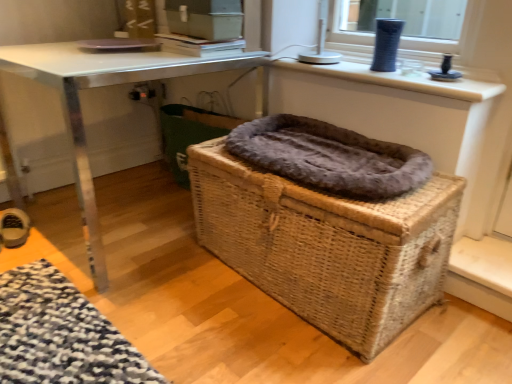
Where is `vacant region to the left of woven brown basket at center`? This screenshot has height=384, width=512. vacant region to the left of woven brown basket at center is located at coordinates click(x=159, y=308).